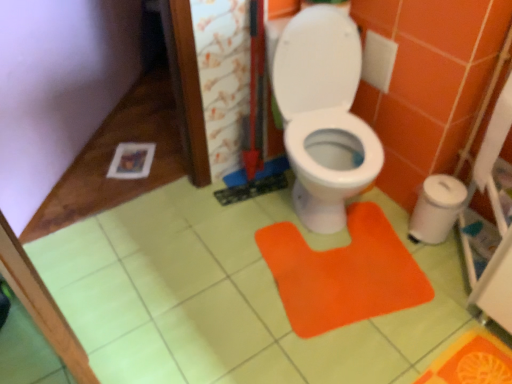
Question: Is white plastic trash can at right next to orange fabric doormat at center and touching it?

Choices:
 (A) no
 (B) yes

Answer: (A)

Question: Is white plastic trash can at right positioned beyond the bounds of orange fabric doormat at center?

Choices:
 (A) no
 (B) yes

Answer: (B)

Question: Does white plastic trash can at right have a larger size compared to orange fabric doormat at center?

Choices:
 (A) yes
 (B) no

Answer: (B)

Question: Is white plastic trash can at right thinner than orange fabric doormat at center?

Choices:
 (A) no
 (B) yes

Answer: (B)

Question: Is white plastic trash can at right taller than orange fabric doormat at center?

Choices:
 (A) yes
 (B) no

Answer: (A)

Question: Could you tell me if white plastic trash can at right is facing orange fabric doormat at center?

Choices:
 (A) no
 (B) yes

Answer: (B)

Question: Can you confirm if white paper at right is bigger than white plastic trash can at right?

Choices:
 (A) no
 (B) yes

Answer: (A)

Question: Can you confirm if white paper at right is thinner than white plastic trash can at right?

Choices:
 (A) no
 (B) yes

Answer: (B)

Question: Is there a large distance between white paper at right and white plastic trash can at right?

Choices:
 (A) yes
 (B) no

Answer: (B)

Question: From the image's perspective, does white paper at right appear higher than white plastic trash can at right?

Choices:
 (A) no
 (B) yes

Answer: (B)

Question: Is white paper at right facing towards white plastic trash can at right?

Choices:
 (A) no
 (B) yes

Answer: (A)

Question: Is white paper at right not inside white plastic trash can at right?

Choices:
 (A) yes
 (B) no

Answer: (A)

Question: Is orange fabric doormat at center aimed at white paper at right?

Choices:
 (A) no
 (B) yes

Answer: (A)